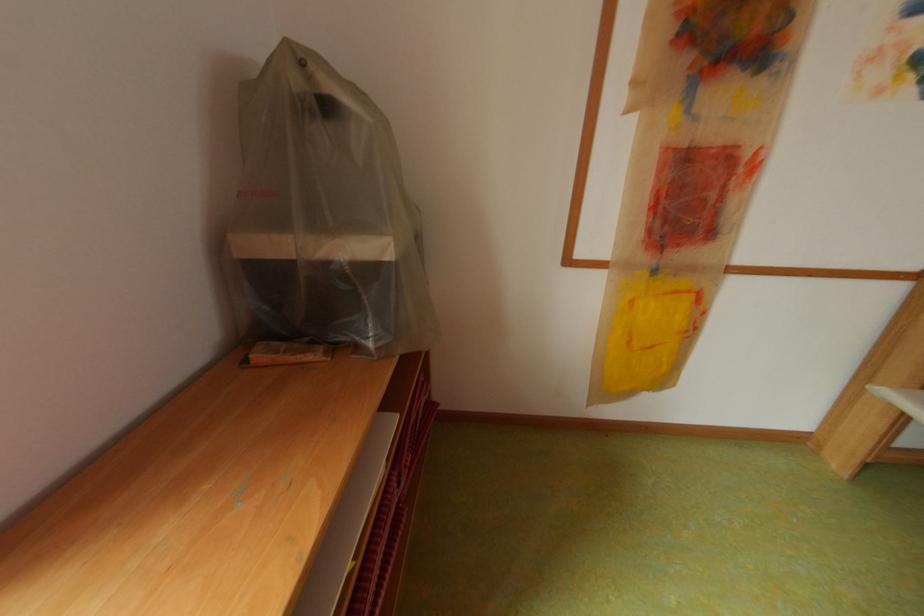
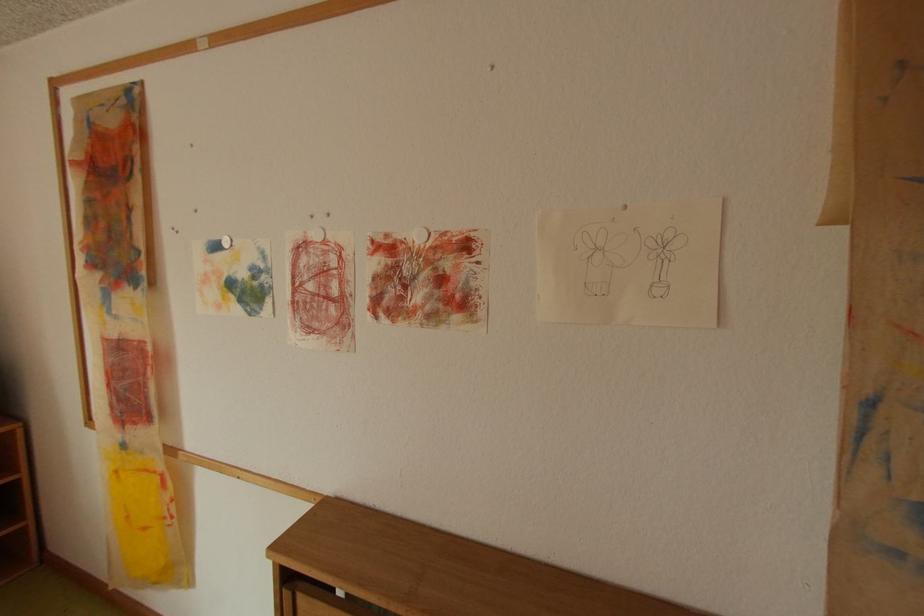
Question: Which direction would the cameraman need to move to produce the second image? Reply with the corresponding letter.

Choices:
 (A) Left
 (B) Right
 (C) Forward
 (D) Backward

Answer: (B)